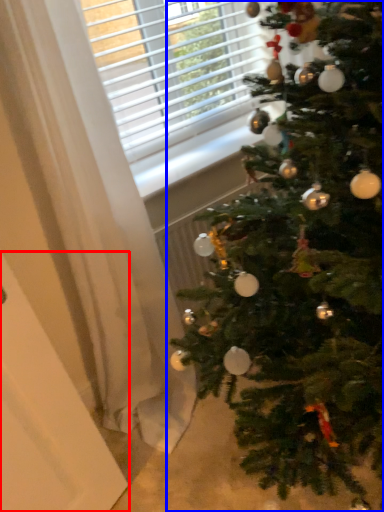
Question: Among these objects, which one is nearest to the camera, screen door (highlighted by a red box) or christmas tree (highlighted by a blue box)?

Choices:
 (A) screen door
 (B) christmas tree

Answer: (B)